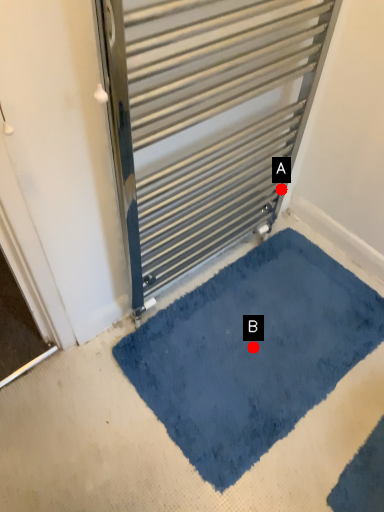
Question: Two points are circled on the image, labeled by A and B beside each circle. Which point is closer to the camera?

Choices:
 (A) A is closer
 (B) B is closer

Answer: (B)